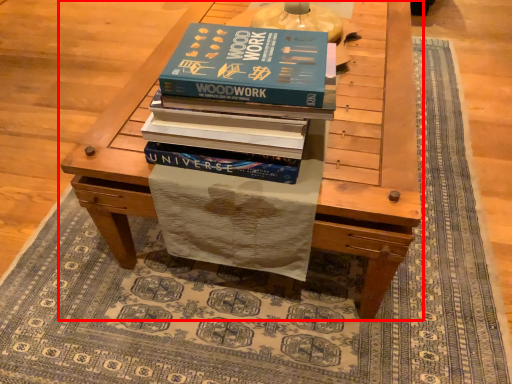
Question: From the image's perspective, considering the relative positions of table (annotated by the red box) and book in the image provided, where is table (annotated by the red box) located with respect to the staircase?

Choices:
 (A) below
 (B) above

Answer: (B)